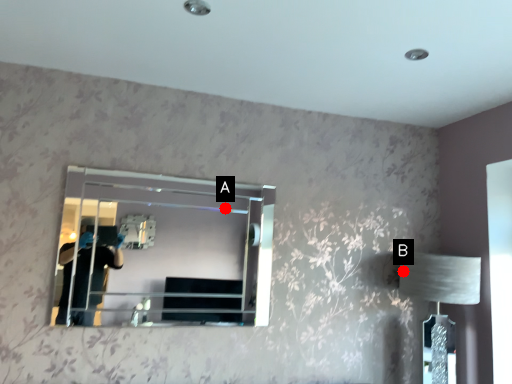
Question: Two points are circled on the image, labeled by A and B beside each circle. Which point is closer to the camera taking this photo?

Choices:
 (A) A is closer
 (B) B is closer

Answer: (A)